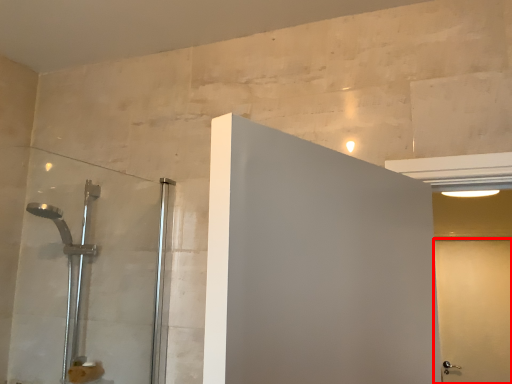
Question: Where is screen door (annotated by the red box) located in relation to shower door in the image?

Choices:
 (A) right
 (B) left

Answer: (A)